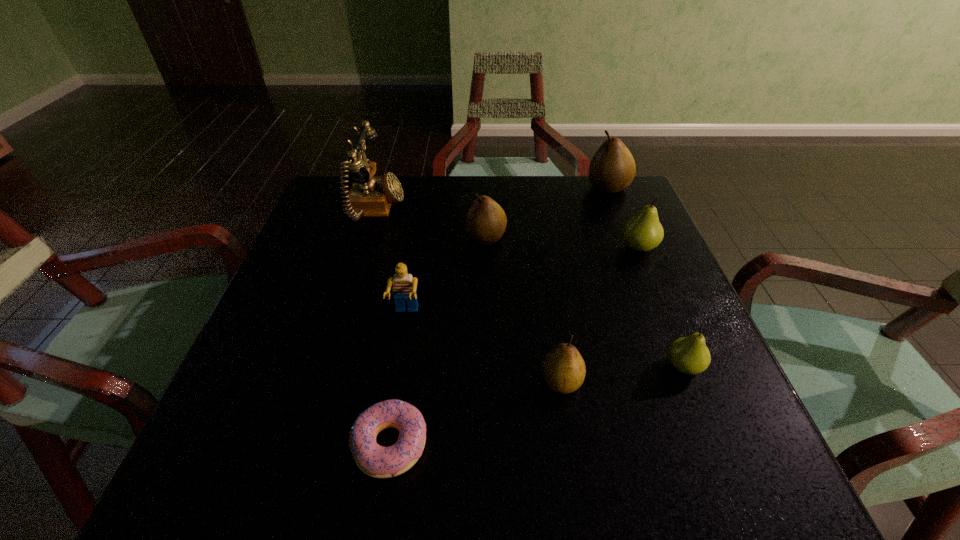
Where is `the smallest brown pear`? the smallest brown pear is located at coordinates (563, 368).

You are a GUI agent. You are given a task and a screenshot of the screen. Output one action in this format:
    pyautogui.click(x=<x>, y=<y>)
    Task: Click on the fifth object from left to right
    
    Given the screenshot: What is the action you would take?
    pyautogui.click(x=563, y=368)

In order to click on pink doughnut in this screenshot , I will do `click(374, 460)`.

Locate an element on the screen. the nearest object is located at coordinates (374, 460).

You are a GUI agent. You are given a task and a screenshot of the screen. Output one action in this format:
    pyautogui.click(x=<x>, y=<y>)
    Task: Click on the free space located on the dial number of the telephone
    Image resolution: width=960 pixels, height=540 pixels.
    Given the screenshot: What is the action you would take?
    pyautogui.click(x=445, y=210)

The image size is (960, 540). Identify the location of vacant area situated 0.190m on the front of the farthest brown pear. (631, 244).

You are a GUI agent. You are given a task and a screenshot of the screen. Output one action in this format:
    pyautogui.click(x=<x>, y=<y>)
    Task: Click on the blank area located on the back of the second biggest brown pear
    The image size is (960, 540).
    Given the screenshot: What is the action you would take?
    pyautogui.click(x=486, y=198)

Find the location of `free location located 0.290m on the left of the bigger green pear`. free location located 0.290m on the left of the bigger green pear is located at coordinates (495, 247).

Identify the location of free space located on the face of the blue Lego. The image size is (960, 540). (378, 484).

The image size is (960, 540). I want to click on vacant space located 0.130m on the front of the nearer green pear, so click(x=720, y=456).